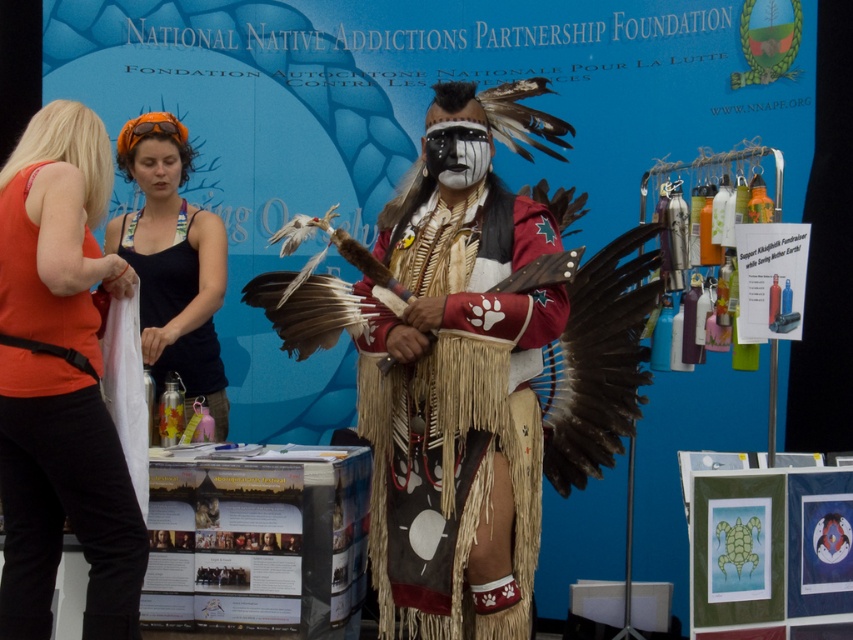
Measure the distance between orange fabric headband at left and orange fabric headband at upper left.

orange fabric headband at left and orange fabric headband at upper left are 29.90 inches apart.

Is point (62, 436) farther from camera compared to point (196, 392)?

That is False.

The height and width of the screenshot is (640, 853). Describe the element at coordinates (61, 381) in the screenshot. I see `orange fabric headband at left` at that location.

Identify the location of orange fabric headband at left. (61, 381).

Is point (370, 506) in front of point (3, 609)?

No, it is not.

Identify the location of fur-like fringed skirt at center. (457, 417).

This screenshot has width=853, height=640. Describe the element at coordinates (457, 417) in the screenshot. I see `fur-like fringed skirt at center` at that location.

Locate an element on the screen. The image size is (853, 640). fur-like fringed skirt at center is located at coordinates (457, 417).

Is fur-like fringed skirt at center thinner than orange fabric headband at upper left?

Incorrect, fur-like fringed skirt at center's width is not less than orange fabric headband at upper left's.

Which is below, fur-like fringed skirt at center or orange fabric headband at upper left?

fur-like fringed skirt at center is lower down.

Locate an element on the screen. fur-like fringed skirt at center is located at coordinates (457, 417).